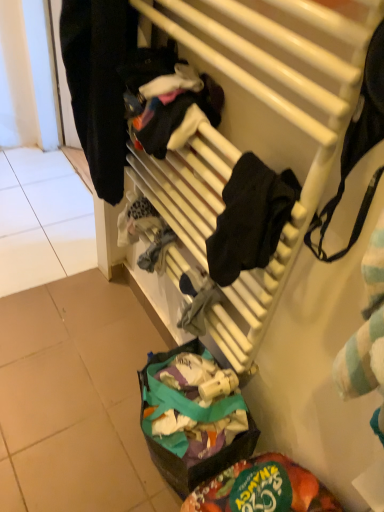
Question: Is green fabric bag at lower center to the left or to the right of black matte clothing at left in the image?

Choices:
 (A) right
 (B) left

Answer: (A)

Question: Is green fabric bag at lower center in front of or behind black matte clothing at left in the image?

Choices:
 (A) behind
 (B) front

Answer: (A)

Question: Estimate the real-world distances between objects in this image. Which object is farther from the black matte clothing at left?

Choices:
 (A) white matte radiator at upper center
 (B) green fabric bag at lower center

Answer: (B)

Question: Estimate the real-world distances between objects in this image. Which object is closer to the white matte radiator at upper center?

Choices:
 (A) green fabric bag at lower center
 (B) black matte clothing at left

Answer: (B)